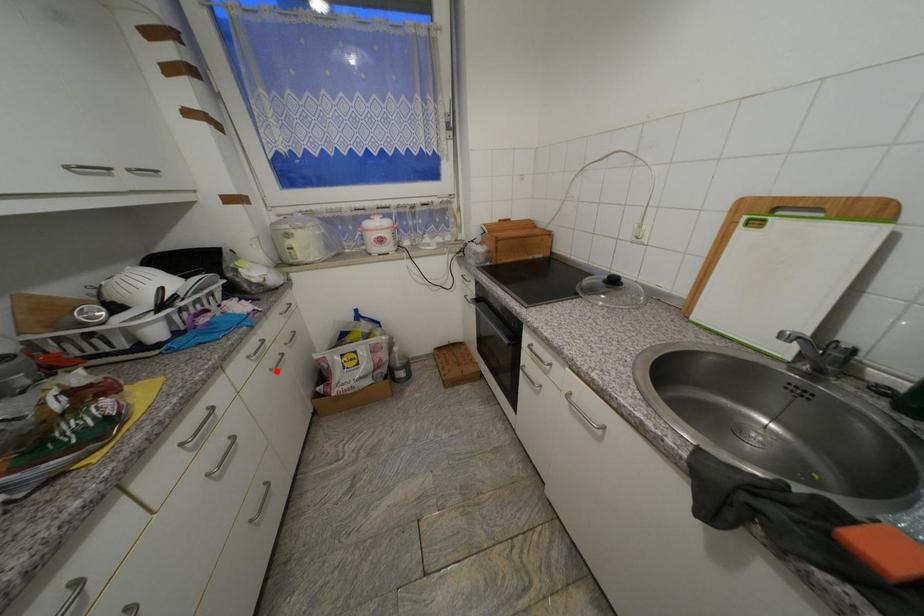
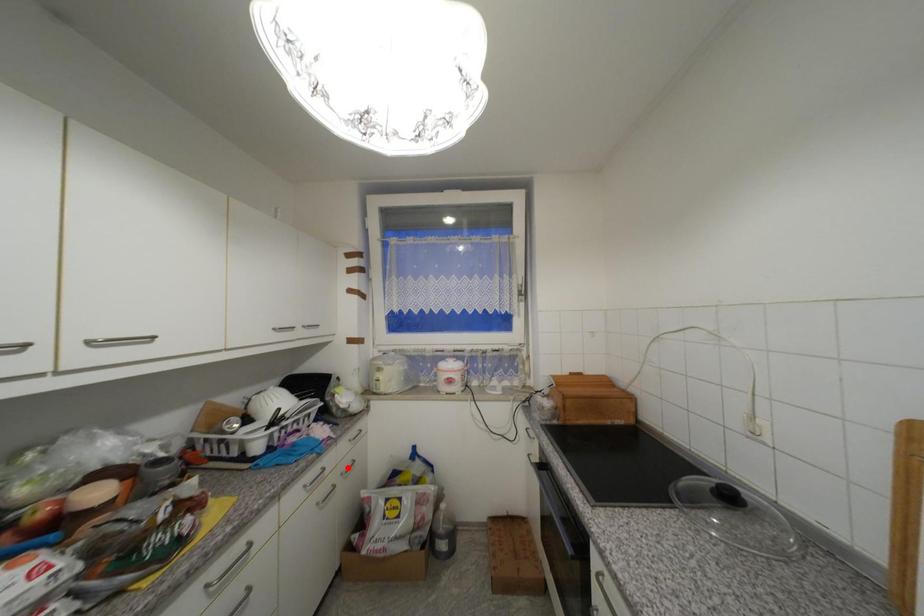
I am providing you with two images of the same scene from different viewpoints. A red point is marked on the first image and another point is marked on the second image. Do the highlighted points in image1 and image2 indicate the same real-world spot?

No